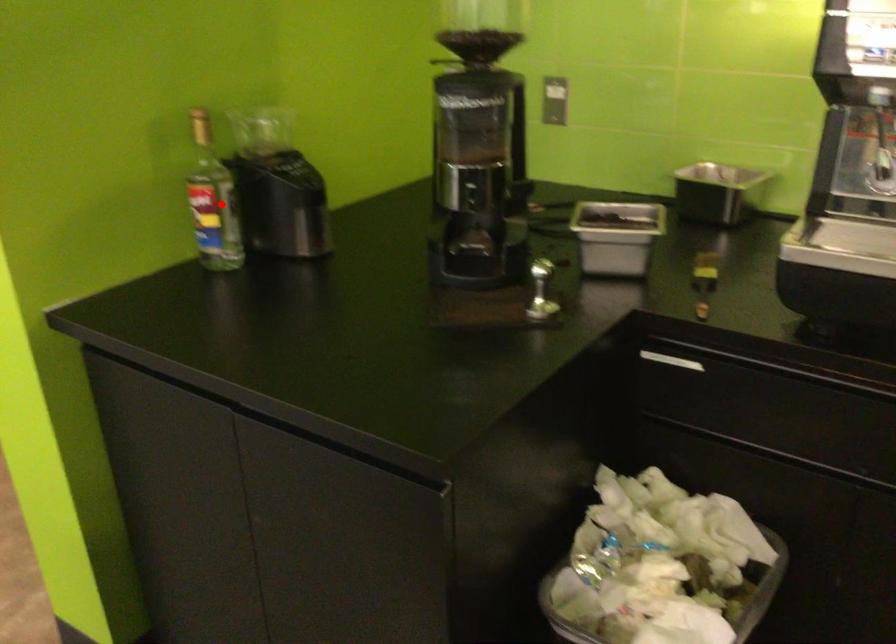
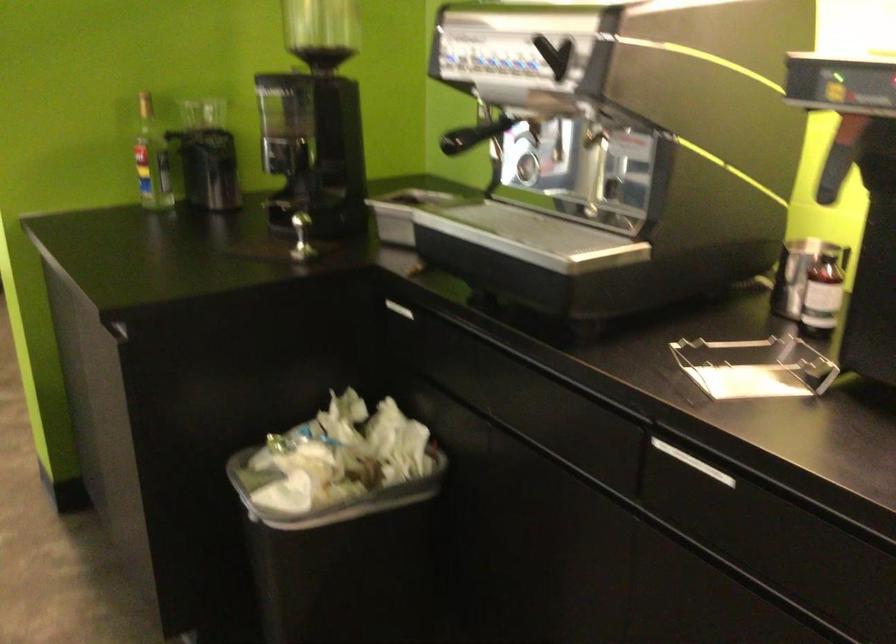
Question: I am providing you with two images of the same scene from different viewpoints. In image1, a red point is highlighted. Considering the same 3D point in image2, which of the following is correct?

Choices:
 (A) It is closer
 (B) It is farther

Answer: (B)